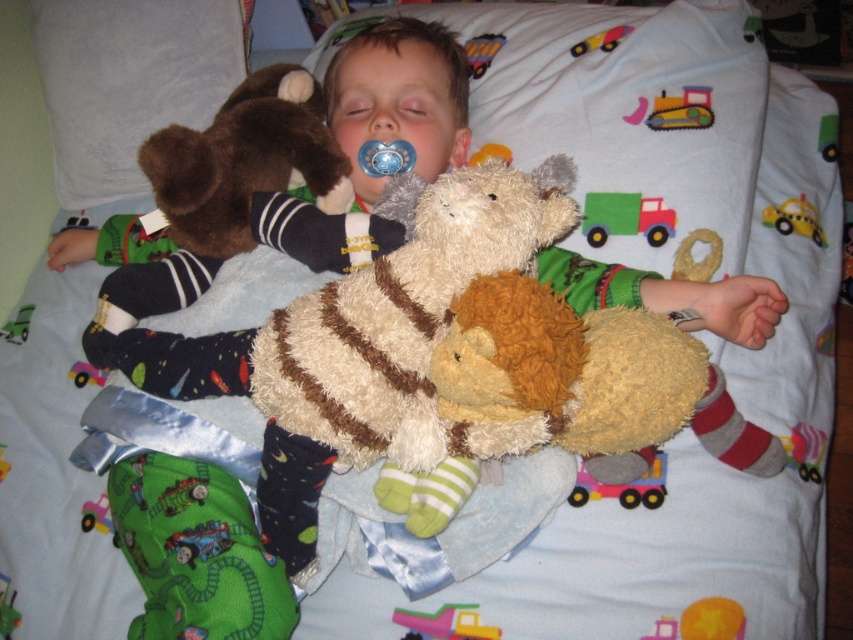
You are a parent checking on your child. You see the green felt truck at upper center and the plush yellow tractor at upper center. Which toy is taller?

The green felt truck at upper center is much taller than the plush yellow tractor at upper center.

You are a parent checking on your child. You see the green fabric train at lower left and the yellow rubber duck at upper right. Which toy is larger?

The green fabric train at lower left is bigger than the yellow rubber duck at upper right.